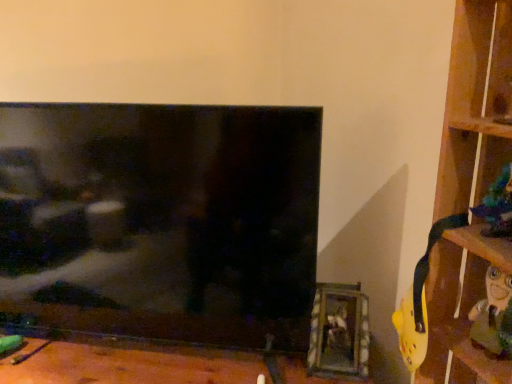
Question: Considering the relative positions of shiny blue figurine at right and wooden picture frame at lower right in the image provided, is shiny blue figurine at right to the right of wooden picture frame at lower right from the viewer's perspective?

Choices:
 (A) no
 (B) yes

Answer: (B)

Question: From a real-world perspective, is shiny blue figurine at right on top of wooden picture frame at lower right?

Choices:
 (A) no
 (B) yes

Answer: (B)

Question: Is shiny blue figurine at right positioned behind wooden picture frame at lower right?

Choices:
 (A) no
 (B) yes

Answer: (A)

Question: From the image's perspective, does shiny blue figurine at right appear lower than wooden picture frame at lower right?

Choices:
 (A) no
 (B) yes

Answer: (A)

Question: Can you confirm if shiny blue figurine at right is bigger than wooden picture frame at lower right?

Choices:
 (A) yes
 (B) no

Answer: (B)

Question: Is shiny blue figurine at right taller than wooden picture frame at lower right?

Choices:
 (A) yes
 (B) no

Answer: (B)

Question: Is wooden at right bigger than shiny blue figurine at right?

Choices:
 (A) yes
 (B) no

Answer: (A)

Question: From a real-world perspective, is wooden at right on shiny blue figurine at right?

Choices:
 (A) no
 (B) yes

Answer: (A)

Question: Are wooden at right and shiny blue figurine at right making contact?

Choices:
 (A) no
 (B) yes

Answer: (A)

Question: From the image's perspective, is wooden at right above shiny blue figurine at right?

Choices:
 (A) yes
 (B) no

Answer: (B)

Question: Is wooden at right smaller than shiny blue figurine at right?

Choices:
 (A) yes
 (B) no

Answer: (B)

Question: Is wooden at right thinner than shiny blue figurine at right?

Choices:
 (A) no
 (B) yes

Answer: (A)

Question: Considering the relative sizes of black glossy tv at center and wooden at right in the image provided, is black glossy tv at center smaller than wooden at right?

Choices:
 (A) yes
 (B) no

Answer: (B)